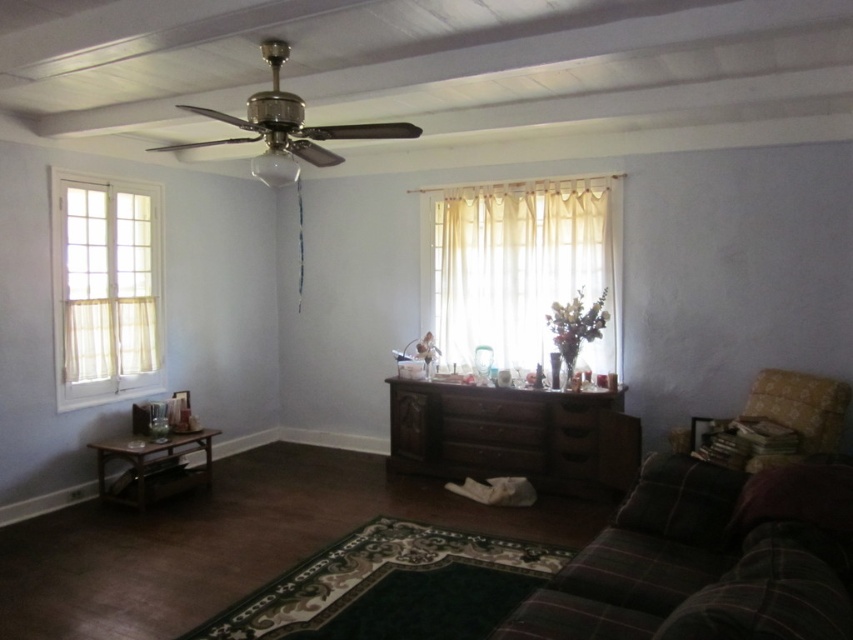
Is floral-patterned fabric armchair at right to the right of brown wood drawer at center from the viewer's perspective?

Indeed, floral-patterned fabric armchair at right is positioned on the right side of brown wood drawer at center.

Can you confirm if floral-patterned fabric armchair at right is taller than brown wood drawer at center?

Yes.

Is point (786, 412) positioned behind point (451, 406)?

No.

Where is `floral-patterned fabric armchair at right`? This screenshot has width=853, height=640. floral-patterned fabric armchair at right is located at coordinates (801, 404).

From the picture: Can you confirm if white sheer curtains at left is positioned above dark brown wood dresser at center?

Yes, white sheer curtains at left is above dark brown wood dresser at center.

Which is behind, point (109, 333) or point (410, 435)?

The point (410, 435) is behind.

At what (x,y) coordinates should I click in order to perform the action: click on white sheer curtains at left. Please return your answer as a coordinate pair (x, y). Image resolution: width=853 pixels, height=640 pixels. Looking at the image, I should click on (106, 289).

Describe the element at coordinates (693, 570) in the screenshot. I see `plaid fabric couch at lower right` at that location.

Can you confirm if plaid fabric couch at lower right is bigger than brown wood drawer at center?

Yes, plaid fabric couch at lower right is bigger than brown wood drawer at center.

In order to click on plaid fabric couch at lower right in this screenshot , I will do [x=693, y=570].